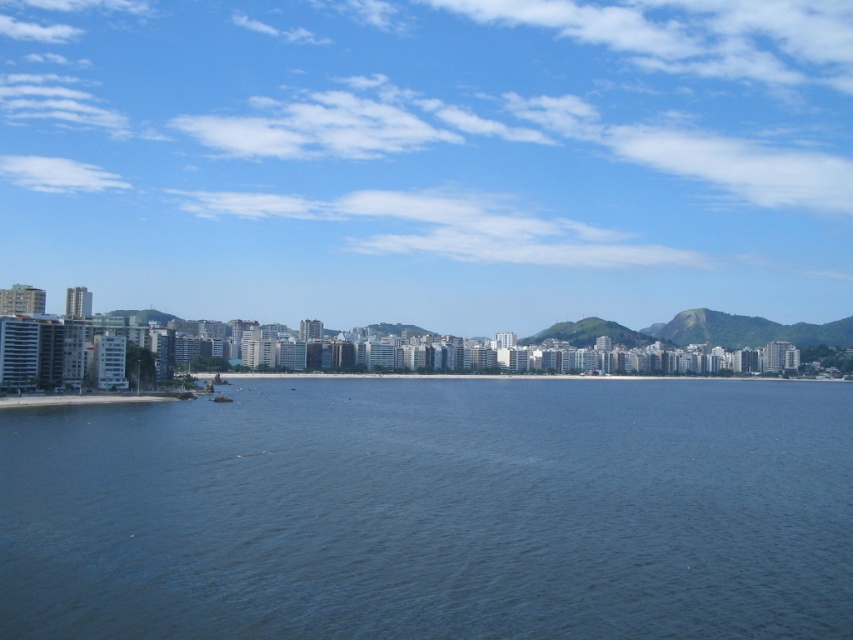
Question: Which point is closer to the camera?

Choices:
 (A) blue liquid water at center
 (B) gray concrete shoreline at lower left

Answer: (A)

Question: Can you confirm if blue sky at upper center is smaller than blue liquid water at center?

Choices:
 (A) yes
 (B) no

Answer: (B)

Question: Where is blue sky at upper center located in relation to gray concrete shoreline at lower left in the image?

Choices:
 (A) above
 (B) below

Answer: (A)

Question: Is the position of blue liquid water at center more distant than that of gray concrete shoreline at lower left?

Choices:
 (A) yes
 (B) no

Answer: (B)

Question: Among these points, which one is farthest from the camera?

Choices:
 (A) (558, 308)
 (B) (44, 397)

Answer: (A)

Question: Considering the real-world distances, which object is farthest from the gray concrete shoreline at lower left?

Choices:
 (A) blue sky at upper center
 (B) blue liquid water at center

Answer: (A)